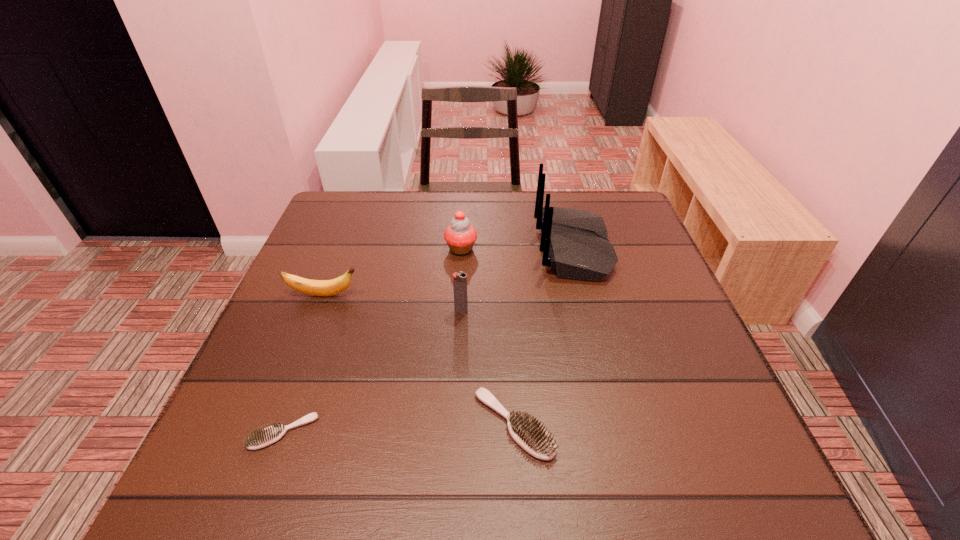
The height and width of the screenshot is (540, 960). I want to click on unoccupied position between the banana and the taller scrubbing brush, so click(x=420, y=360).

What are the coordinates of `free spot between the banana and the shorter scrubbing brush` in the screenshot? It's located at (303, 363).

Locate an element on the screen. The image size is (960, 540). vacant point located between the rightmost object and the cupcake is located at coordinates (517, 248).

The height and width of the screenshot is (540, 960). What are the coordinates of `unoccupied position between the router and the fourth tallest object` in the screenshot? It's located at (448, 272).

The height and width of the screenshot is (540, 960). Identify the location of free space between the third shortest object and the router. (448, 272).

Identify the location of free spot between the cupcake and the tallest object. (517, 248).

Find the location of `free spot between the third farthest object and the rightmost object`. free spot between the third farthest object and the rightmost object is located at coordinates (448, 272).

Image resolution: width=960 pixels, height=540 pixels. Find the location of `object that is the fifth closest to the banana`. object that is the fifth closest to the banana is located at coordinates (574, 242).

Image resolution: width=960 pixels, height=540 pixels. In order to click on the fourth closest object relative to the shortest object in this screenshot , I will do `click(460, 236)`.

Locate an element on the screen. vacant space that satisfies the following two spatial constraints: 1. at the stem of the banana; 2. on the left side of the third nearest object is located at coordinates (318, 311).